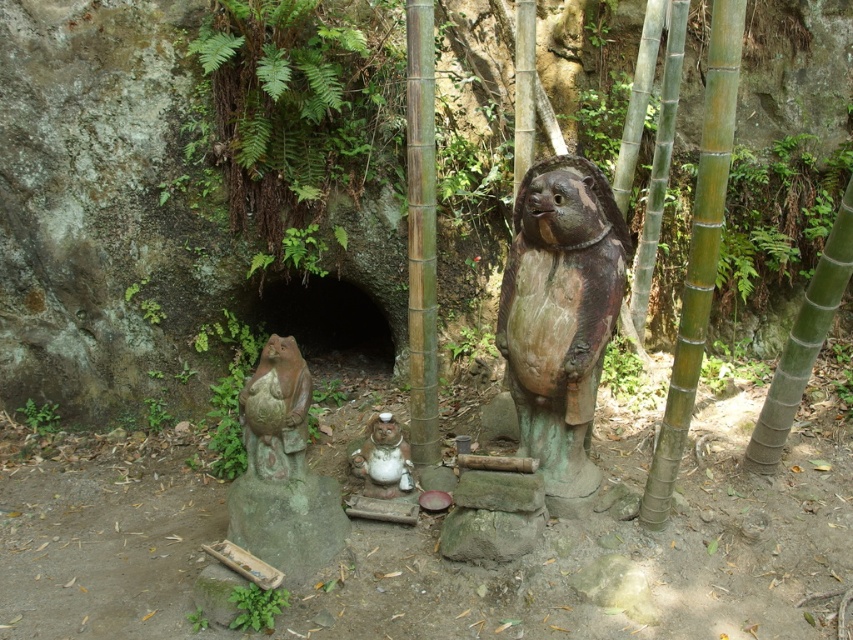
Image resolution: width=853 pixels, height=640 pixels. In order to click on rustic stone statue at lower left in this screenshot , I will do `click(276, 412)`.

Between rustic stone statue at lower left and white glossy statue at center, which one is positioned lower?

white glossy statue at center

What do you see at coordinates (276, 412) in the screenshot?
I see `rustic stone statue at lower left` at bounding box center [276, 412].

Where is `rustic stone statue at lower left`? rustic stone statue at lower left is located at coordinates (276, 412).

Can you confirm if rustic wood bear at center is smaller than white glossy statue at center?

Incorrect, rustic wood bear at center is not smaller in size than white glossy statue at center.

From the picture: Does rustic wood bear at center have a greater width compared to white glossy statue at center?

Correct, the width of rustic wood bear at center exceeds that of white glossy statue at center.

Is point (550, 364) closer to camera compared to point (386, 493)?

Yes, it is.

This screenshot has height=640, width=853. I want to click on rustic wood bear at center, so click(x=560, y=317).

Between rustic wood bear at center and rustic stone statue at lower left, which one is positioned higher?

rustic wood bear at center is above.

Is rustic wood bear at center positioned before rustic stone statue at lower left?

Yes, it is.

Locate an element on the screen. The height and width of the screenshot is (640, 853). rustic wood bear at center is located at coordinates (560, 317).

Identify the location of rustic wood bear at center. Image resolution: width=853 pixels, height=640 pixels. (560, 317).